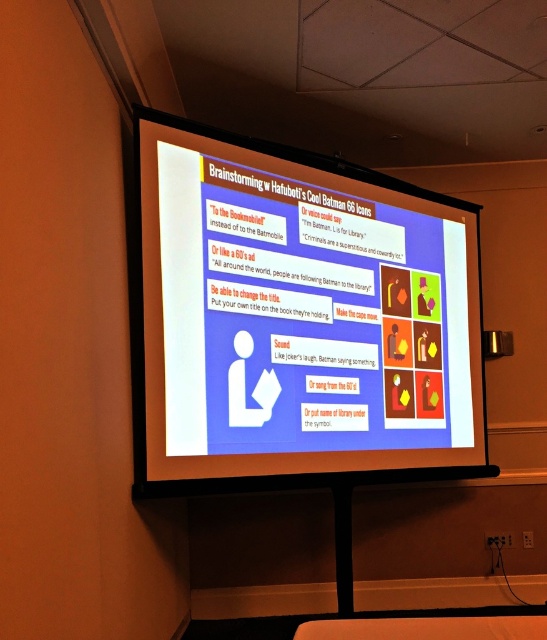
You are standing in front of the presentation screen and want to point out two specific ideas. The first idea is located at point (305, 244) and the second idea is at point 0.636, 0.623. If you can reach up to 3 meters, can you touch both points with your finger?

The two points are 3.52 meters apart. Since your maximum reach is 3 meters, you cannot touch both points simultaneously.

You are setting up for a presentation and need to place a large poster. The white glossy projector screen at center and the matte black flat at lower center are both available. Which object should you choose to ensure the poster is visible to everyone in the room?

The white glossy projector screen at center has a larger size compared to the matte black flat at lower center, so it would be better to choose the white glossy projector screen at center to ensure the poster is visible to everyone in the room.

You are setting up for a presentation and need to place a laptop on the matte black flat at lower center. However, you want to ensure that the laptop won not block the view of the white glossy projector screen at center. Is the current arrangement possible?

The white glossy projector screen at center is above the matte black flat at lower center, so placing the laptop on the matte black flat at lower center will not block the view of the screen since it is positioned below the screen.